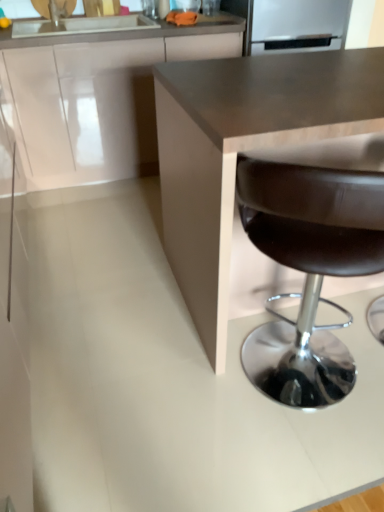
Question: Visually, is white glossy cabinet at upper left positioned to the left or to the right of brown leather stool at lower right?

Choices:
 (A) right
 (B) left

Answer: (B)

Question: From the image's perspective, is white glossy cabinet at upper left located above or below brown leather stool at lower right?

Choices:
 (A) below
 (B) above

Answer: (B)

Question: Which object is positioned farthest from the satin silver refrigerator at upper center?

Choices:
 (A) matte brown countertop at center
 (B) brown leather stool at lower right
 (C) white glossy cabinet at upper left

Answer: (B)

Question: Based on their relative distances, which object is farther from the matte brown countertop at center?

Choices:
 (A) white glossy cabinet at upper left
 (B) satin silver refrigerator at upper center
 (C) brown leather stool at lower right

Answer: (B)